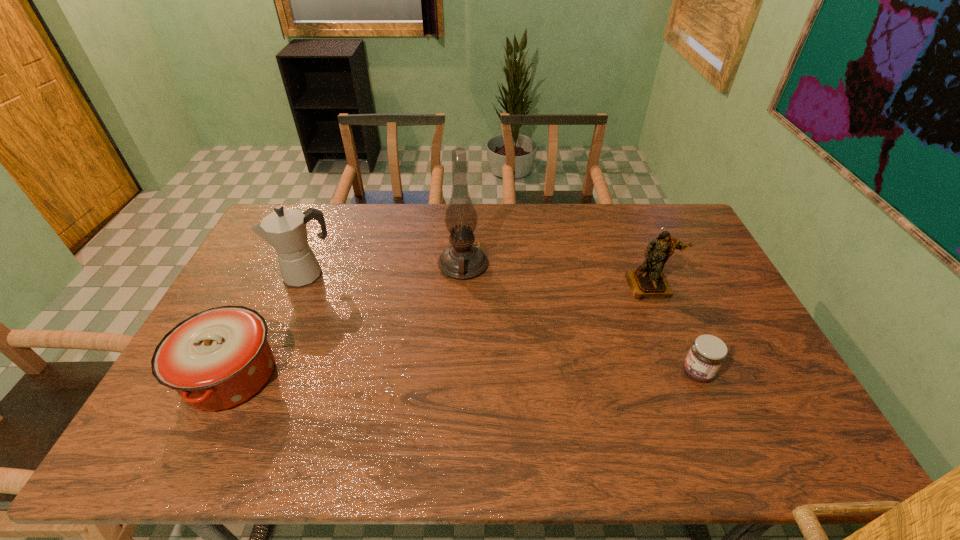
Where is `free spot between the second shortest object and the figurine`? This screenshot has height=540, width=960. free spot between the second shortest object and the figurine is located at coordinates (441, 330).

This screenshot has height=540, width=960. Identify the location of free area in between the figurine and the third object from right to left. (557, 275).

At what (x,y) coordinates should I click in order to perform the action: click on object identified as the third closest to the oil lamp. Please return your answer as a coordinate pair (x, y). Looking at the image, I should click on (648, 281).

Identify the location of object that is the fourth closest to the casserole. (707, 353).

This screenshot has width=960, height=540. I want to click on free location that satisfies the following two spatial constraints: 1. on the back side of the coffeepot; 2. on the left side of the third object from right to left, so click(310, 265).

This screenshot has width=960, height=540. I want to click on vacant space that satisfies the following two spatial constraints: 1. on the back side of the oil lamp; 2. on the left side of the casserole, so click(285, 265).